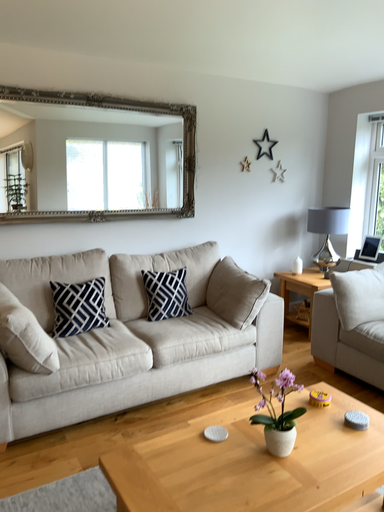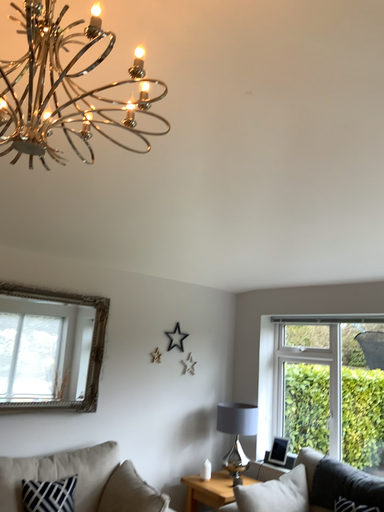
Question: Which way did the camera rotate in the video?

Choices:
 (A) rotated left
 (B) rotated right

Answer: (B)